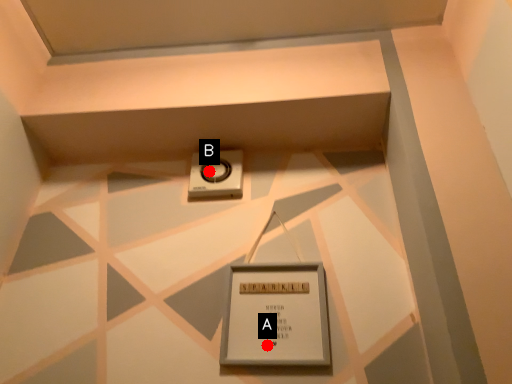
Question: Two points are circled on the image, labeled by A and B beside each circle. Which point appears closest to the camera in this image?

Choices:
 (A) A is closer
 (B) B is closer

Answer: (A)